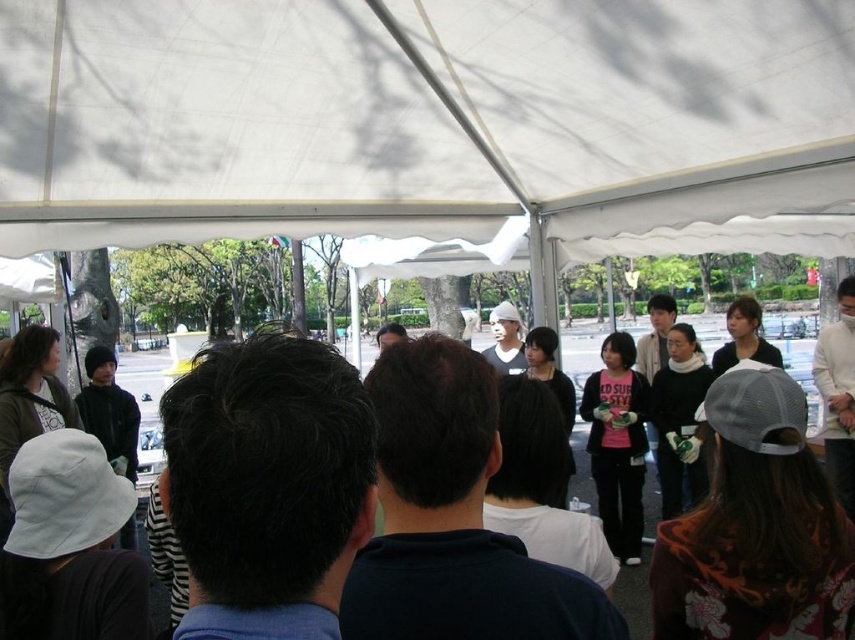
You are standing at the entrance of the event and want to take a photo of the white fabric canopy at upper center and the matte black jacket at center. Which object should you focus on first to ensure both are in focus?

You should focus on the matte black jacket at center first because it is farther away from the viewer than the white fabric canopy at upper center, so adjusting focus from near to far will help both be in focus.

You are planning to set up a small table under the white fabric canopy at upper center for a booth. The table you have is as wide as the matte black jacket at center. Will the table fit under the canopy?

The white fabric canopy at upper center is narrower than the matte black jacket at center, so the table, which is as wide as the matte black jacket at center, will not fit under the canopy.